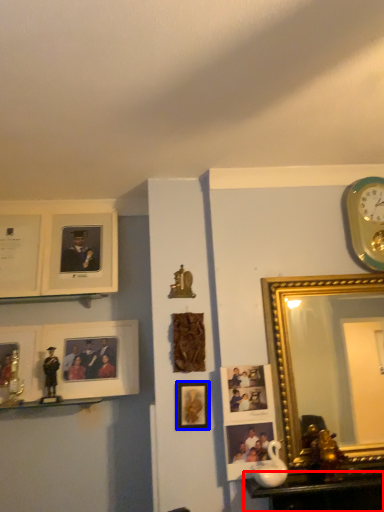
Question: Among these objects, which one is farthest to the camera, table (highlighted by a red box) or picture frame (highlighted by a blue box)?

Choices:
 (A) table
 (B) picture frame

Answer: (B)